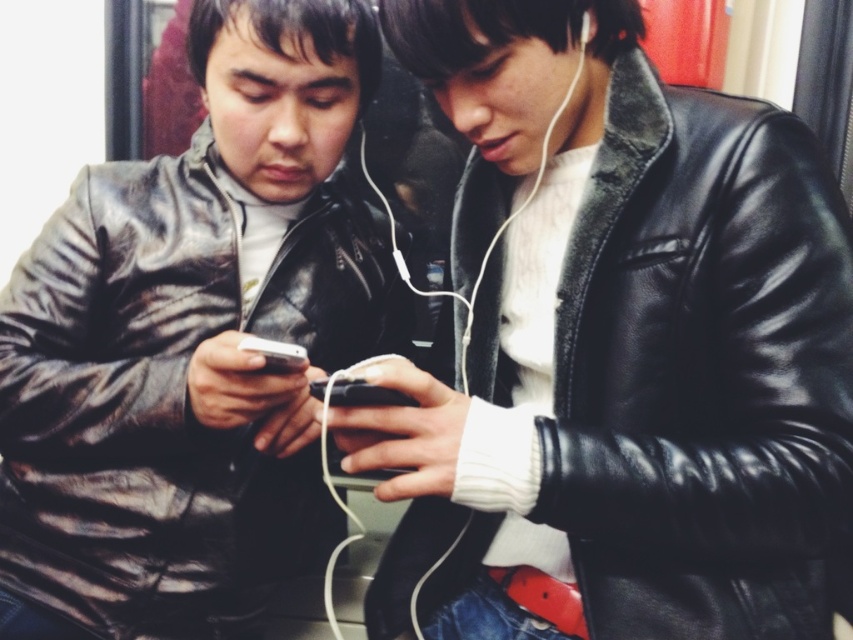
Based on the photo, you are a fashion designer analyzing the image of two jackets worn by people sitting on public transport. The jackets are labeled as matte black jacket at center and black leather jacket at center. Which of these two jackets appears taller on the person?

The matte black jacket at center appears taller than the black leather jacket at center.

From the picture: You are a photographer trying to capture the matte black jacket at center. According to the coordinates provided, where should you focus your camera?

The matte black jacket at center is located at coordinates point (189, 342).